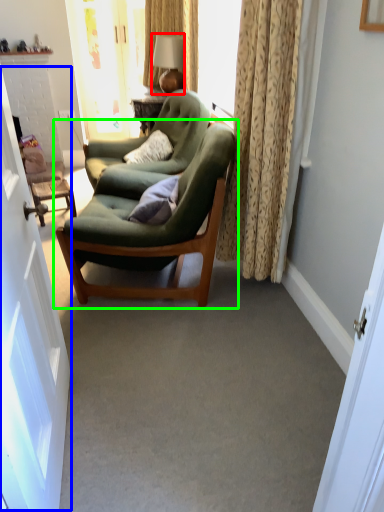
Question: Estimate the real-world distances between objects in this image. Which object is farther from lamp (highlighted by a red box), screen door (highlighted by a blue box) or chair (highlighted by a green box)?

Choices:
 (A) screen door
 (B) chair

Answer: (A)